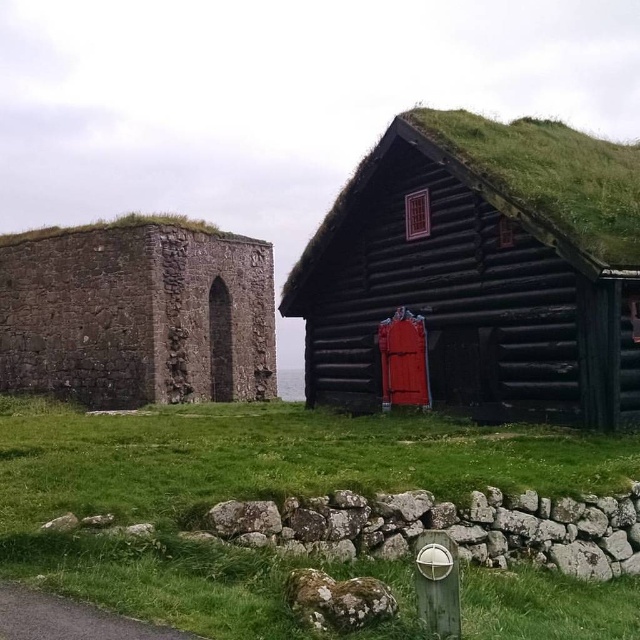
Question: Is dark brown wooden log cabin at center below rustic stone wall at left?

Choices:
 (A) yes
 (B) no

Answer: (B)

Question: Does dark brown wooden log cabin at center have a lesser width compared to rustic stone wall at left?

Choices:
 (A) no
 (B) yes

Answer: (B)

Question: Which object appears closest to the camera in this image?

Choices:
 (A) rustic stone wall at left
 (B) dark brown wooden log cabin at center

Answer: (B)

Question: Among these points, which one is farthest from the camera?

Choices:
 (A) (618, 173)
 (B) (33, 570)
 (C) (45, 328)

Answer: (C)

Question: Is green grass at lower center smaller than rustic stone wall at left?

Choices:
 (A) yes
 (B) no

Answer: (A)

Question: Which object appears closest to the camera in this image?

Choices:
 (A) dark brown wooden log cabin at center
 (B) rustic stone wall at left
 (C) green grass at lower center

Answer: (C)